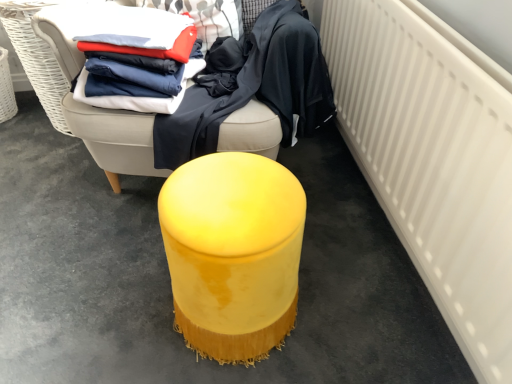
Question: Can you confirm if matte cotton shirts at upper left, arranged as the second clothing when viewed from the right, is wider than velvet yellow ottoman at center, placed as the 1th furniture when sorted from bottom to top?

Choices:
 (A) no
 (B) yes

Answer: (B)

Question: Can velvet yellow ottoman at center, placed as the 1th furniture when sorted from bottom to top, be found inside matte cotton shirts at upper left, arranged as the second clothing when viewed from the right?

Choices:
 (A) no
 (B) yes

Answer: (A)

Question: Is there a large distance between matte cotton shirts at upper left, arranged as the second clothing when viewed from the right, and velvet yellow ottoman at center, placed as the 1th furniture when sorted from bottom to top?

Choices:
 (A) no
 (B) yes

Answer: (A)

Question: Is the depth of matte cotton shirts at upper left, arranged as the second clothing when viewed from the right, greater than that of velvet yellow ottoman at center, placed as the 1th furniture when sorted from bottom to top?

Choices:
 (A) yes
 (B) no

Answer: (A)

Question: From the image's perspective, does matte cotton shirts at upper left, arranged as the second clothing when viewed from the right, appear lower than velvet yellow ottoman at center, placed as the 1th furniture when sorted from bottom to top?

Choices:
 (A) no
 (B) yes

Answer: (A)

Question: Is matte cotton shirts at upper left, arranged as the second clothing when viewed from the right, positioned with its back to velvet yellow ottoman at center, the second furniture when ordered from top to bottom?

Choices:
 (A) yes
 (B) no

Answer: (B)

Question: Can you confirm if velvet yellow ottoman at center, the second furniture when ordered from top to bottom, is bigger than white matte radiator at right?

Choices:
 (A) no
 (B) yes

Answer: (A)

Question: Is velvet yellow ottoman at center, placed as the 1th furniture when sorted from bottom to top, not inside white matte radiator at right?

Choices:
 (A) yes
 (B) no

Answer: (A)

Question: From a real-world perspective, is velvet yellow ottoman at center, placed as the 1th furniture when sorted from bottom to top, located beneath white matte radiator at right?

Choices:
 (A) no
 (B) yes

Answer: (B)

Question: Considering the relative sizes of velvet yellow ottoman at center, placed as the 1th furniture when sorted from bottom to top, and white matte radiator at right in the image provided, is velvet yellow ottoman at center, placed as the 1th furniture when sorted from bottom to top, wider than white matte radiator at right?

Choices:
 (A) yes
 (B) no

Answer: (A)

Question: Is velvet yellow ottoman at center, placed as the 1th furniture when sorted from bottom to top, beside white matte radiator at right?

Choices:
 (A) no
 (B) yes

Answer: (A)

Question: Could you tell me if velvet yellow ottoman at center, the second furniture when ordered from top to bottom, is facing white matte radiator at right?

Choices:
 (A) yes
 (B) no

Answer: (B)

Question: From the image's perspective, is velvet yellow ottoman at center, positioned as the first furniture in top-to-bottom order, beneath white matte radiator at right?

Choices:
 (A) yes
 (B) no

Answer: (B)